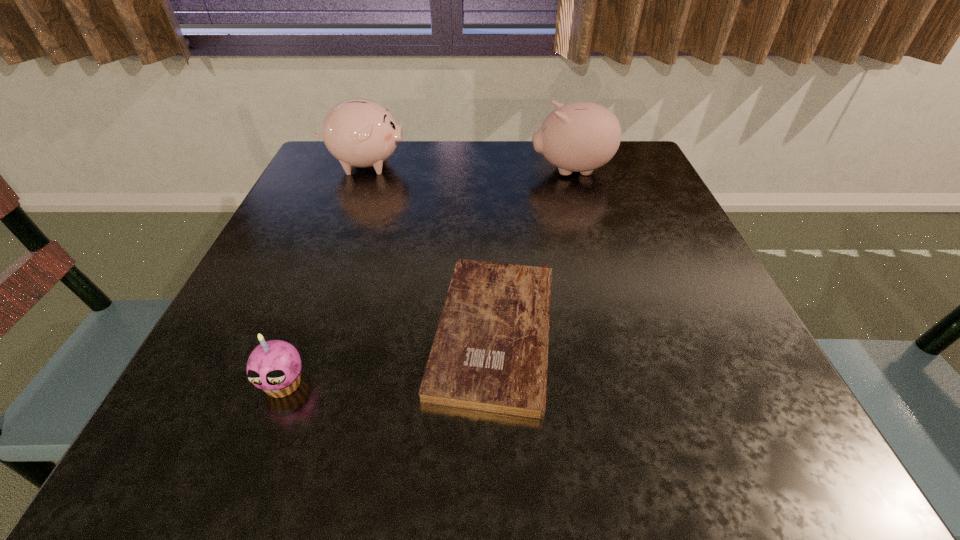
The image size is (960, 540). Find the location of `object that is at the near edge`. object that is at the near edge is located at coordinates (490, 353).

This screenshot has width=960, height=540. I want to click on piggy bank positioned at the left edge, so click(358, 132).

Find the location of a particular element. This screenshot has height=540, width=960. cupcake that is at the left edge is located at coordinates (276, 361).

Find the location of a particular element. object that is positioned at the right edge is located at coordinates (581, 136).

You are a GUI agent. You are given a task and a screenshot of the screen. Output one action in this format:
    pyautogui.click(x=<x>, y=<y>)
    Task: Click on the object situated at the far left corner
    Image resolution: width=960 pixels, height=540 pixels.
    Given the screenshot: What is the action you would take?
    pyautogui.click(x=358, y=132)

The height and width of the screenshot is (540, 960). I want to click on object located in the far right corner section of the desktop, so click(581, 136).

In the image, there is a desktop. Where is `free space at the far edge`? The height and width of the screenshot is (540, 960). free space at the far edge is located at coordinates (456, 187).

The image size is (960, 540). Identify the location of vacant point at the left edge. (315, 332).

Locate an element on the screen. vacant space at the right edge of the desktop is located at coordinates (602, 198).

The width and height of the screenshot is (960, 540). Find the location of `vacant space at the near left corner of the desktop`. vacant space at the near left corner of the desktop is located at coordinates (253, 424).